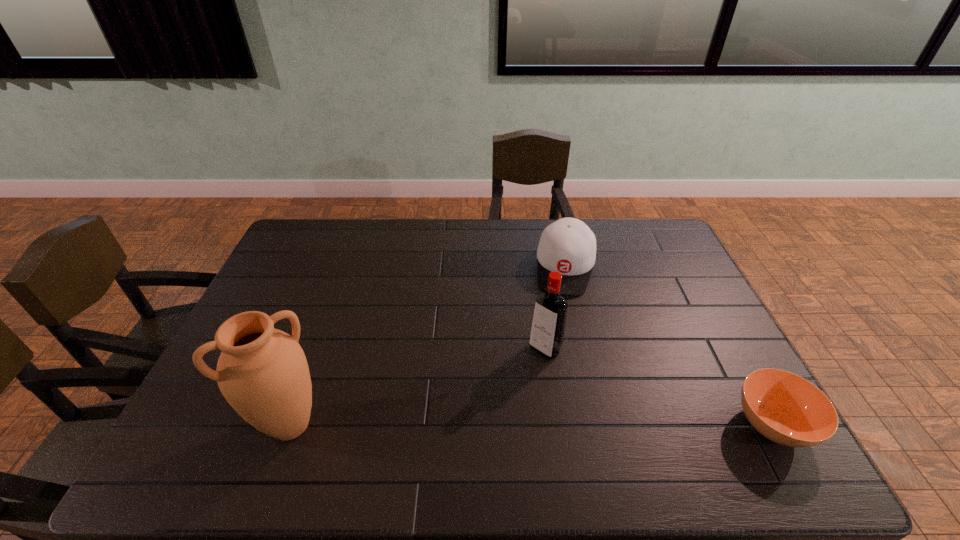
Locate an element on the screen. Image resolution: width=960 pixels, height=540 pixels. vacant space located on the front and back of the second tallest object is located at coordinates (520, 374).

Image resolution: width=960 pixels, height=540 pixels. Find the location of `vacant region located 0.280m on the front and back of the second tallest object`. vacant region located 0.280m on the front and back of the second tallest object is located at coordinates 468,428.

Locate an element on the screen. This screenshot has width=960, height=540. blank space located 0.180m on the front and back of the second tallest object is located at coordinates coord(493,401).

Identify the location of vacant space situated on the front-facing side of the farthest object. tap(558, 347).

Identify the location of vacant area situated 0.170m on the front-facing side of the farthest object. (560, 336).

Locate an element on the screen. free space located on the front-facing side of the farthest object is located at coordinates (558, 349).

At what (x,y) coordinates should I click in order to perform the action: click on object situated at the far edge. Please return your answer as a coordinate pair (x, y). Looking at the image, I should click on (568, 246).

Where is `urn positioned at the near edge`? The image size is (960, 540). urn positioned at the near edge is located at coordinates (262, 372).

Image resolution: width=960 pixels, height=540 pixels. What are the coordinates of `soup bowl positioned at the near edge` in the screenshot? It's located at (785, 408).

At what (x,y) coordinates should I click in order to perform the action: click on object present at the right edge. Please return your answer as a coordinate pair (x, y). Looking at the image, I should click on (785, 408).